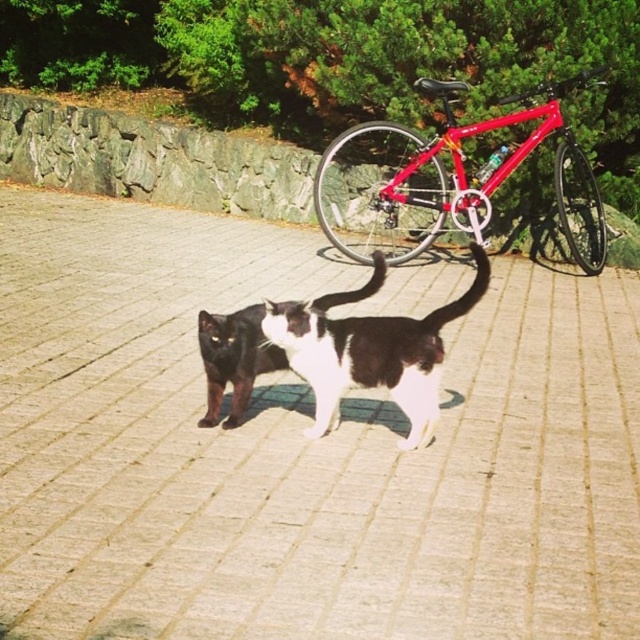
Which is in front, point (516, 180) or point (365, 330)?

Point (365, 330)

Between metallic bicycle at upper right and white fur cat at center, which one has more height?

With more height is metallic bicycle at upper right.

At what (x,y) coordinates should I click in order to perform the action: click on metallic bicycle at upper right. Please return your answer as a coordinate pair (x, y). Image resolution: width=640 pixels, height=640 pixels. Looking at the image, I should click on (340, 61).

The width and height of the screenshot is (640, 640). What are the coordinates of `metallic bicycle at upper right` in the screenshot? It's located at [x=340, y=61].

Does white fur cat at center have a lesser height compared to black and white fur cat at center?

In fact, white fur cat at center may be taller than black and white fur cat at center.

Who is more distant from viewer, [440,355] or [259,362]?

Point [259,362]

Which is behind, point (412, 433) or point (288, 365)?

Point (288, 365)

Locate an element on the screen. This screenshot has height=640, width=640. white fur cat at center is located at coordinates (371, 355).

Does brick pavement at center come behind red glossy bicycle at center?

No, brick pavement at center is closer to the viewer.

Which is in front, point (433, 465) or point (353, 237)?

Point (433, 465)

Where is `brick pavement at center`? brick pavement at center is located at coordinates (300, 449).